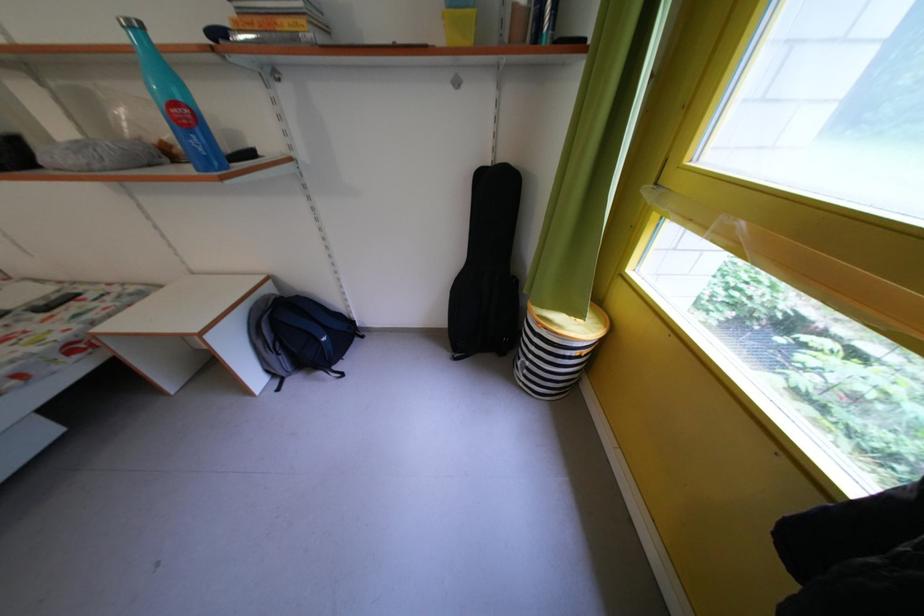
Find where to lift the blue water bottle. Please return your answer as a coordinate pair (x, y).

(175, 100)